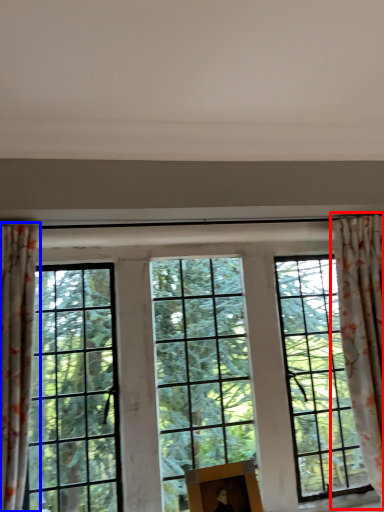
Question: Which point is further to the camera, curtain (highlighted by a red box) or curtain (highlighted by a blue box)?

Choices:
 (A) curtain
 (B) curtain

Answer: (A)